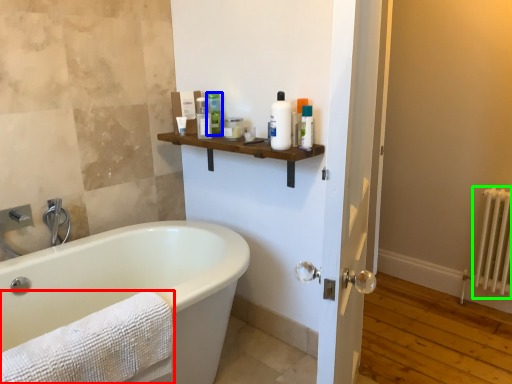
Question: Considering the real-world distances, which object is farthest from towel (highlighted by a red box)? toiletry (highlighted by a blue box) or radiator (highlighted by a green box)?

Choices:
 (A) toiletry
 (B) radiator

Answer: (B)